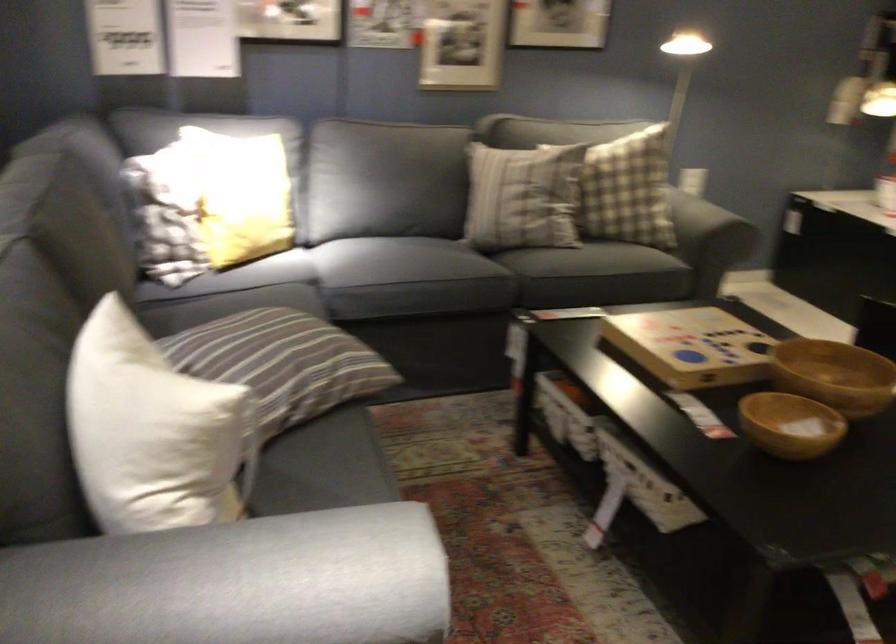
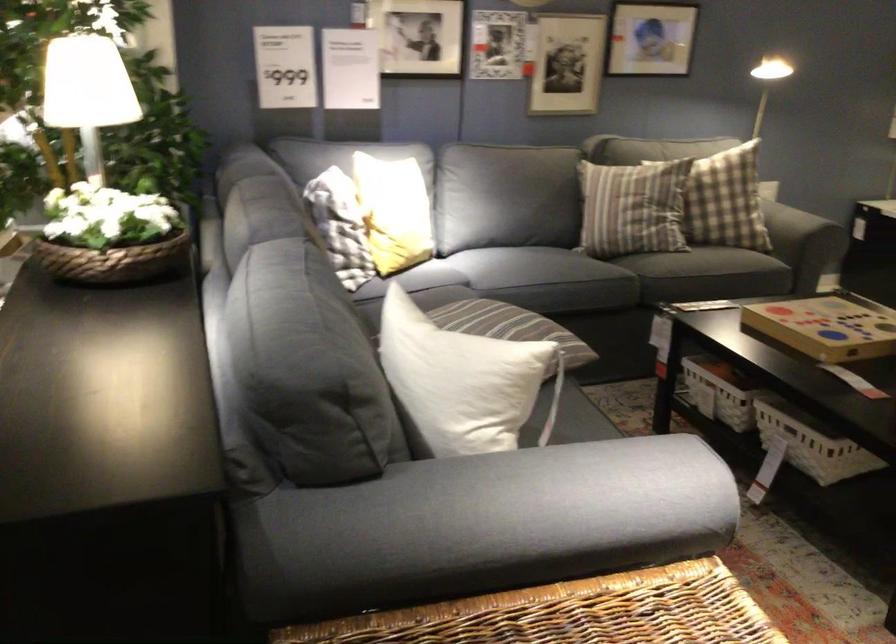
The point at [669,353] is marked in the first image. Where is the corresponding point in the second image?

(828, 326)